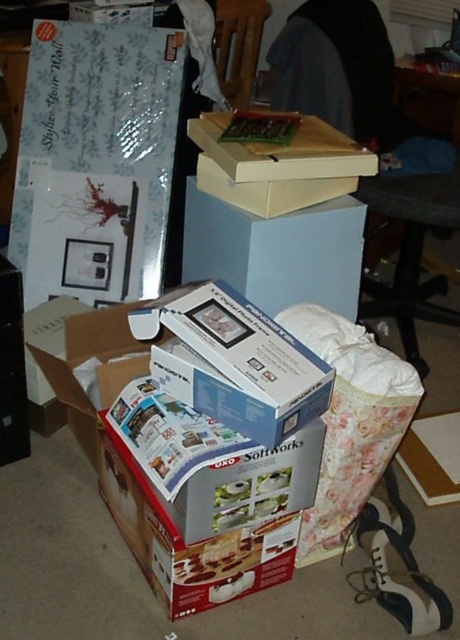
Question: Does white matte box at center have a larger size compared to matte cardboard box at upper center?

Choices:
 (A) no
 (B) yes

Answer: (A)

Question: Which object is farther from the camera taking this photo?

Choices:
 (A) white matte box at center
 (B) matte cardboard box at upper center
 (C) light blue cardboard box at center

Answer: (C)

Question: Does light blue cardboard box at center appear under matte cardboard box at upper center?

Choices:
 (A) yes
 (B) no

Answer: (A)

Question: Which of the following is the farthest from the observer?

Choices:
 (A) (254, 179)
 (B) (333, 212)

Answer: (B)

Question: Among these objects, which one is nearest to the camera?

Choices:
 (A) light blue cardboard box at center
 (B) matte cardboard box at upper center

Answer: (B)

Question: Can you confirm if white matte box at center is positioned above matte cardboard box at upper center?

Choices:
 (A) yes
 (B) no

Answer: (B)